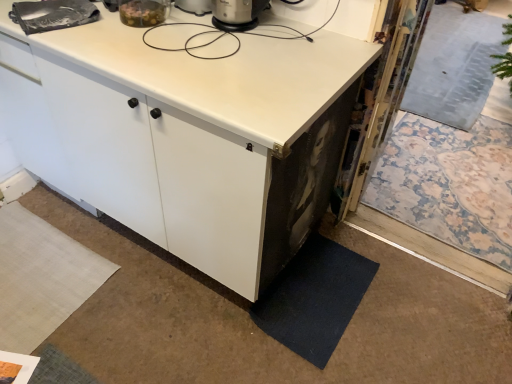
Identify the location of vacant point above dark blue carpet at lower right (from a real-world perspective). (306, 285).